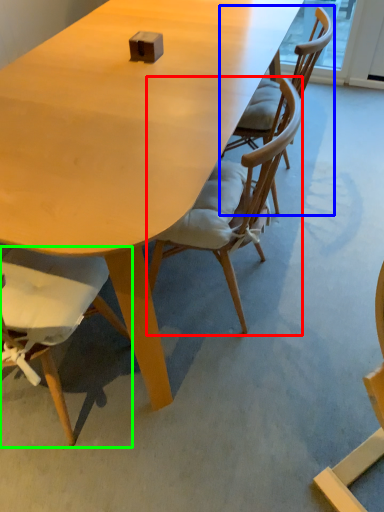
Question: Considering the real-world distances, which object is closest to chair (highlighted by a red box)? chair (highlighted by a blue box) or chair (highlighted by a green box).

Choices:
 (A) chair
 (B) chair

Answer: (A)